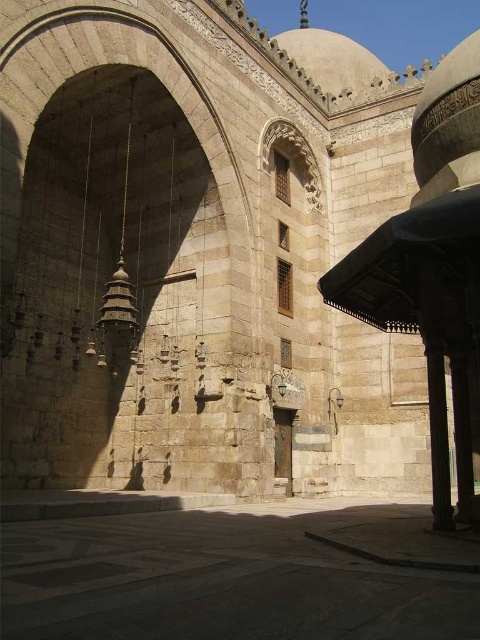
You are a tour guide leading a group through this historical site. You want to lead your group from the gray stone courtyard at lower center to the brown stone pillar at right. How far will you have to walk to reach the pillar from the courtyard?

The distance between the gray stone courtyard at lower center and the brown stone pillar at right is 34.65 feet, so you will have to walk 34.65 feet to reach the pillar from the courtyard.

You are standing in front of the historical stone structure and want to take a photo. There are two points marked in the image, point 1 at coordinates point (420,628) and point 2 at coordinates point (445,422). Which point is closer to you?

Point (420,628) is closer to the camera than point (445,422).

You are standing in the historical stone structure and want to walk from the gray stone courtyard at lower center to the brown stone pillar at right. In which direction should you move?

You should move to the right to reach the brown stone pillar at right from the gray stone courtyard at lower center since the gray stone courtyard at lower center is located to the left of the brown stone pillar at right.